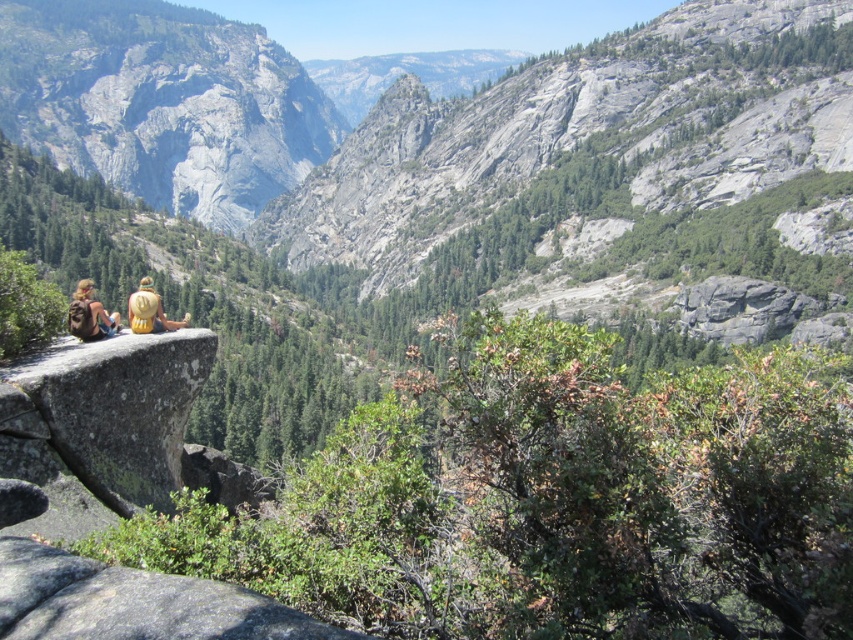
Question: Which object appears farthest from the camera in this image?

Choices:
 (A) golden straw hat at center
 (B) matte yellow hat at center

Answer: (A)

Question: Is matte yellow hat at center closer to the viewer compared to golden straw hat at center?

Choices:
 (A) yes
 (B) no

Answer: (A)

Question: Is matte yellow hat at center positioned behind golden straw hat at center?

Choices:
 (A) no
 (B) yes

Answer: (A)

Question: Which point is farther to the camera?

Choices:
 (A) pos(91,285)
 (B) pos(158,310)
 (C) pos(93,337)

Answer: (A)

Question: Is matte yellow hat at center positioned before golden straw hat at center?

Choices:
 (A) yes
 (B) no

Answer: (A)

Question: Which of the following is the farthest from the observer?

Choices:
 (A) (173, 324)
 (B) (141, 326)
 (C) (80, 316)

Answer: (A)